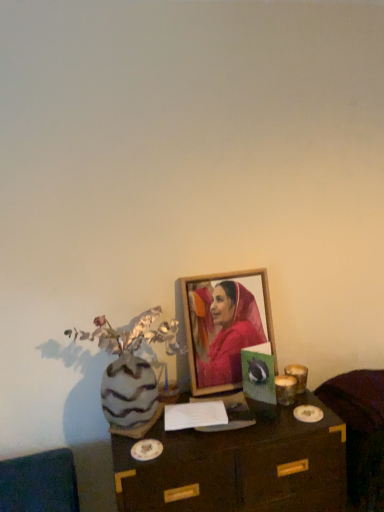
Question: Is velvet dark brown armchair at lower right outside wooden table at center?

Choices:
 (A) no
 (B) yes

Answer: (B)

Question: Is velvet dark brown armchair at lower right bigger than wooden table at center?

Choices:
 (A) yes
 (B) no

Answer: (B)

Question: Is velvet dark brown armchair at lower right oriented away from wooden table at center?

Choices:
 (A) no
 (B) yes

Answer: (A)

Question: From a real-world perspective, is velvet dark brown armchair at lower right on wooden table at center?

Choices:
 (A) no
 (B) yes

Answer: (B)

Question: Would you say wooden table at center is part of velvet dark brown armchair at lower right's contents?

Choices:
 (A) yes
 (B) no

Answer: (B)

Question: Is velvet dark brown armchair at lower right thinner than wooden table at center?

Choices:
 (A) no
 (B) yes

Answer: (B)

Question: Is velvet dark brown armchair at lower right wider than wooden picture frame at center?

Choices:
 (A) no
 (B) yes

Answer: (B)

Question: From a real-world perspective, is velvet dark brown armchair at lower right located beneath wooden picture frame at center?

Choices:
 (A) no
 (B) yes

Answer: (B)

Question: Is the depth of velvet dark brown armchair at lower right greater than that of wooden picture frame at center?

Choices:
 (A) yes
 (B) no

Answer: (B)

Question: Considering the relative sizes of velvet dark brown armchair at lower right and wooden picture frame at center in the image provided, is velvet dark brown armchair at lower right shorter than wooden picture frame at center?

Choices:
 (A) yes
 (B) no

Answer: (A)

Question: Is velvet dark brown armchair at lower right outside of wooden picture frame at center?

Choices:
 (A) yes
 (B) no

Answer: (A)

Question: Is velvet dark brown armchair at lower right at the right side of wooden picture frame at center?

Choices:
 (A) yes
 (B) no

Answer: (A)

Question: Is wooden table at center taller than wooden picture frame at center?

Choices:
 (A) no
 (B) yes

Answer: (B)